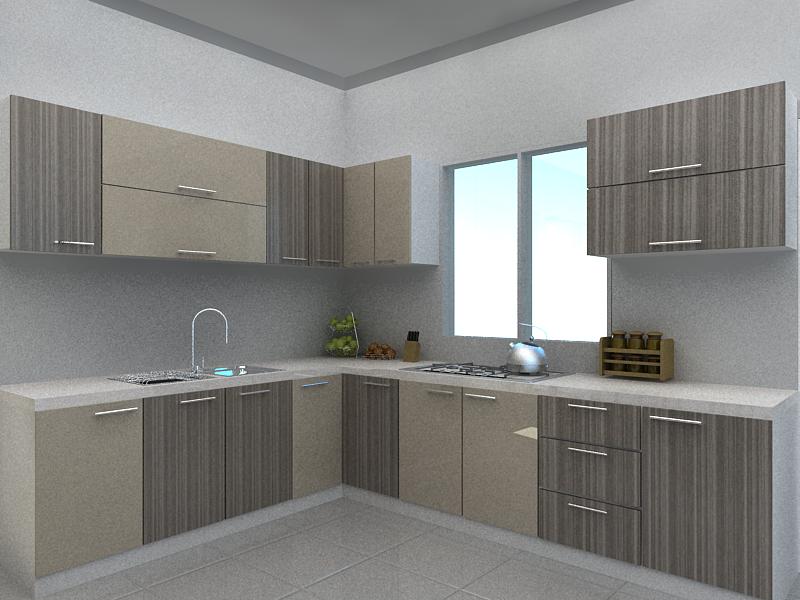
Locate an element on the screen. rack is located at coordinates (656, 354).